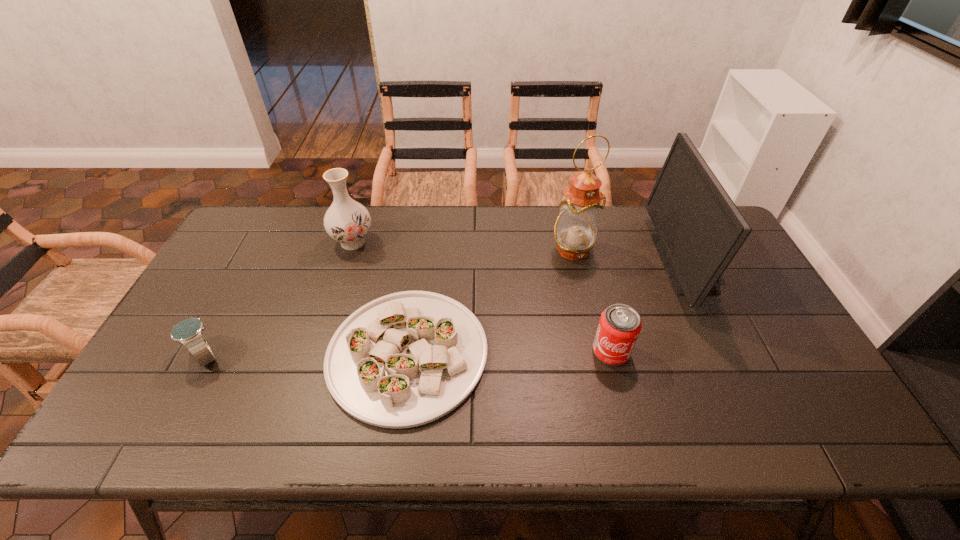
Image resolution: width=960 pixels, height=540 pixels. In order to click on object located in the left edge section of the desktop in this screenshot , I will do `click(188, 332)`.

The width and height of the screenshot is (960, 540). I want to click on object that is at the right edge, so click(x=699, y=228).

Where is `object positioned at the far right corner`? The height and width of the screenshot is (540, 960). object positioned at the far right corner is located at coordinates 699,228.

The height and width of the screenshot is (540, 960). In the image, there is a desktop. In order to click on vacant area at the far edge in this screenshot , I will do `click(642, 210)`.

This screenshot has height=540, width=960. In the image, there is a desktop. Identify the location of vacant space at the near edge. (243, 408).

Where is `vacant region at the left edge of the desktop`? This screenshot has width=960, height=540. vacant region at the left edge of the desktop is located at coordinates (225, 347).

The image size is (960, 540). Identify the location of vacant area at the right edge of the desktop. (757, 336).

I want to click on vacant region at the far left corner of the desktop, so click(257, 220).

Find the location of a particular element. The image size is (960, 540). vacant space at the near left corner of the desktop is located at coordinates (156, 414).

Find the location of a particular element. Image resolution: width=960 pixels, height=540 pixels. free spot between the shortest object and the fourth tallest object is located at coordinates (510, 353).